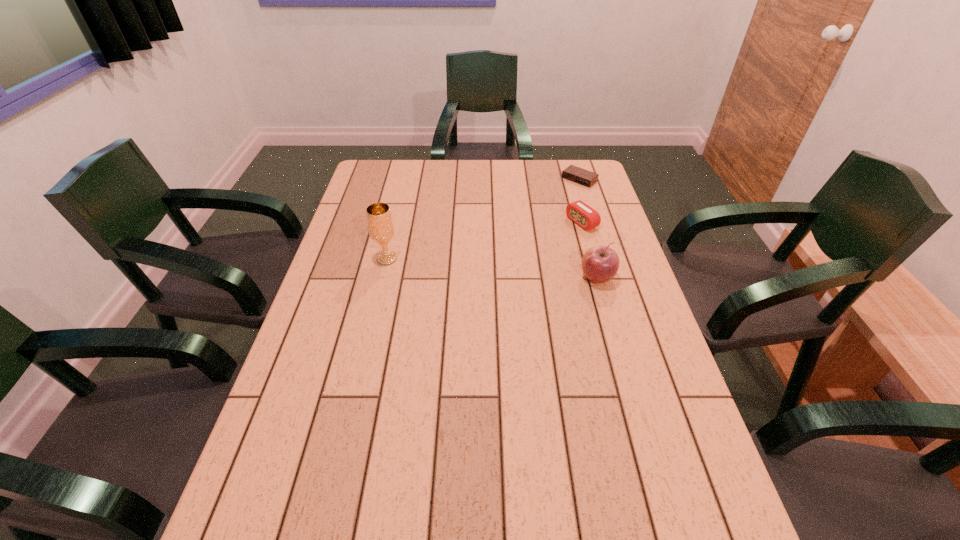
In the image, there is a desktop. Identify the location of free space at the near edge. This screenshot has width=960, height=540. (569, 499).

The width and height of the screenshot is (960, 540). I want to click on free space at the left edge of the desktop, so click(x=376, y=252).

You are a GUI agent. You are given a task and a screenshot of the screen. Output one action in this format:
    pyautogui.click(x=<x>, y=<y>)
    Task: Click on the free region at the right edge
    
    Given the screenshot: What is the action you would take?
    pyautogui.click(x=628, y=374)

Where is `free space at the far right corner`? Image resolution: width=960 pixels, height=540 pixels. free space at the far right corner is located at coordinates (578, 160).

The height and width of the screenshot is (540, 960). I want to click on vacant space that's between the leftmost object and the second shortest object, so click(484, 241).

The height and width of the screenshot is (540, 960). In order to click on free spot between the tallest object and the second tallest object in this screenshot , I will do `click(492, 268)`.

The width and height of the screenshot is (960, 540). Find the location of `vacant area between the shorter alarm clock and the tallest object`. vacant area between the shorter alarm clock and the tallest object is located at coordinates (483, 219).

At what (x,y) coordinates should I click in order to perform the action: click on free spot between the nearer alarm clock and the tallest object. Please return your answer as a coordinate pair (x, y). Looking at the image, I should click on (484, 241).

Identify the location of free point between the third nearest object and the tallest object. (484, 241).

I want to click on vacant space that's between the nearer alarm clock and the tallest object, so click(484, 241).